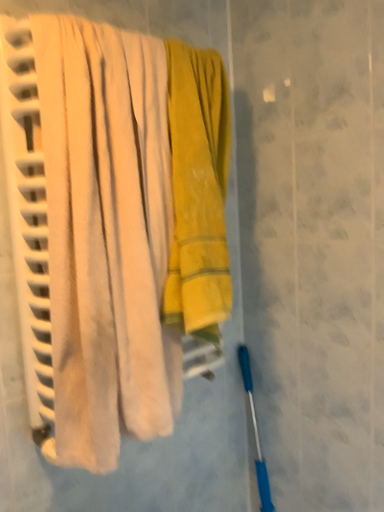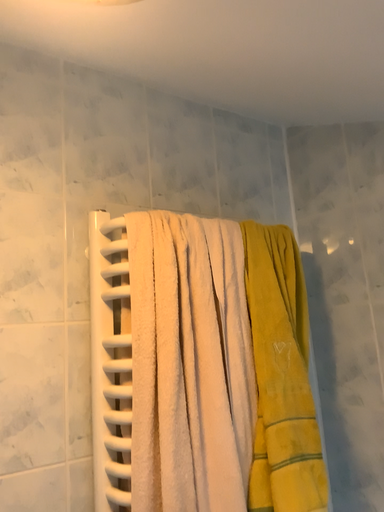
Question: How did the camera likely rotate when shooting the video?

Choices:
 (A) rotated upward
 (B) rotated downward

Answer: (A)